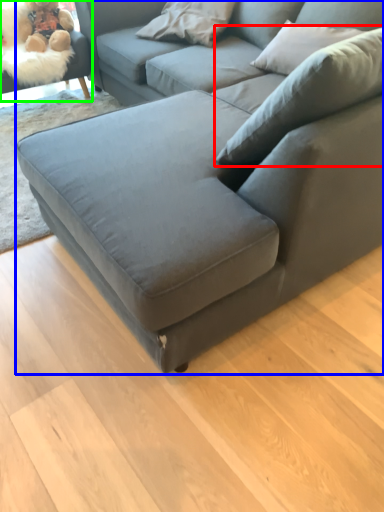
Question: Considering the real-world distances, which object is closest to pillow (highlighted by a red box)? studio couch (highlighted by a blue box) or swivel chair (highlighted by a green box).

Choices:
 (A) studio couch
 (B) swivel chair

Answer: (A)